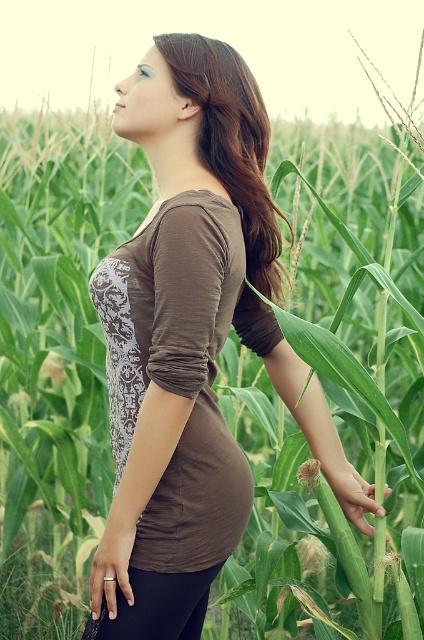
Does brown matte shirt at center have a smaller size compared to brown matte hair at center?

No.

The image size is (424, 640). In order to click on brown matte shirt at center in this screenshot , I will do `click(192, 342)`.